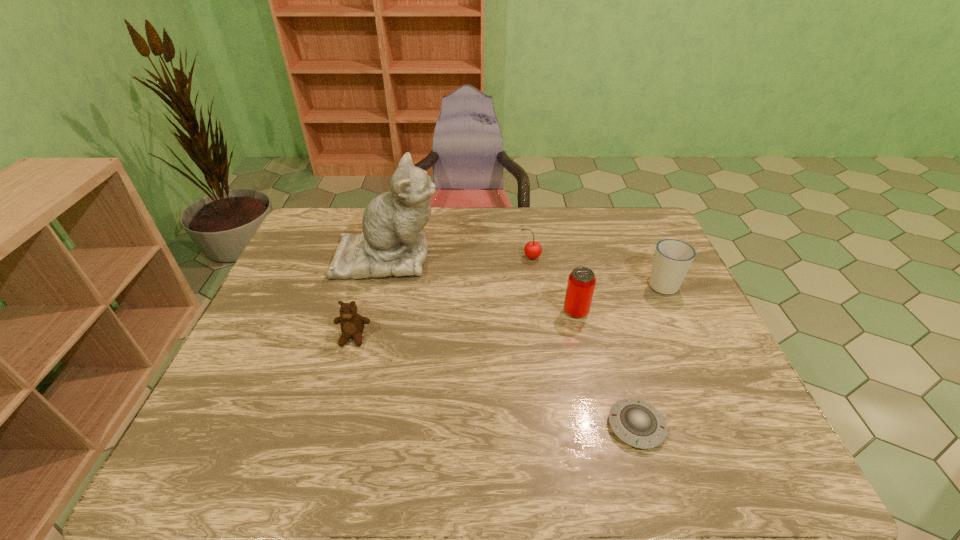
Where is `cat`? This screenshot has height=540, width=960. cat is located at coordinates (393, 243).

Identify the location of the third nearest object. (581, 283).

Find the location of a particular element. the rightmost object is located at coordinates (672, 259).

Where is `cherry`? cherry is located at coordinates (533, 249).

Where is `teddy bear`? teddy bear is located at coordinates (352, 324).

At what (x,y) coordinates should I click in order to perform the action: click on the nearest object. Please return your answer as a coordinate pair (x, y). This screenshot has width=960, height=540. Looking at the image, I should click on (637, 423).

You are a GUI agent. You are given a task and a screenshot of the screen. Output one action in this format:
    pyautogui.click(x=<x>, y=<y>)
    Task: Click on the shortest object
    The height and width of the screenshot is (540, 960).
    Given the screenshot: What is the action you would take?
    pyautogui.click(x=637, y=423)

The width and height of the screenshot is (960, 540). I want to click on vacant position located 0.070m on the front-facing side of the tallest object, so pos(463,256).

The width and height of the screenshot is (960, 540). In order to click on free space located on the right of the can in this screenshot , I will do `click(611, 312)`.

The height and width of the screenshot is (540, 960). I want to click on free region located 0.190m with a handle on the side of the cup, so click(x=639, y=234).